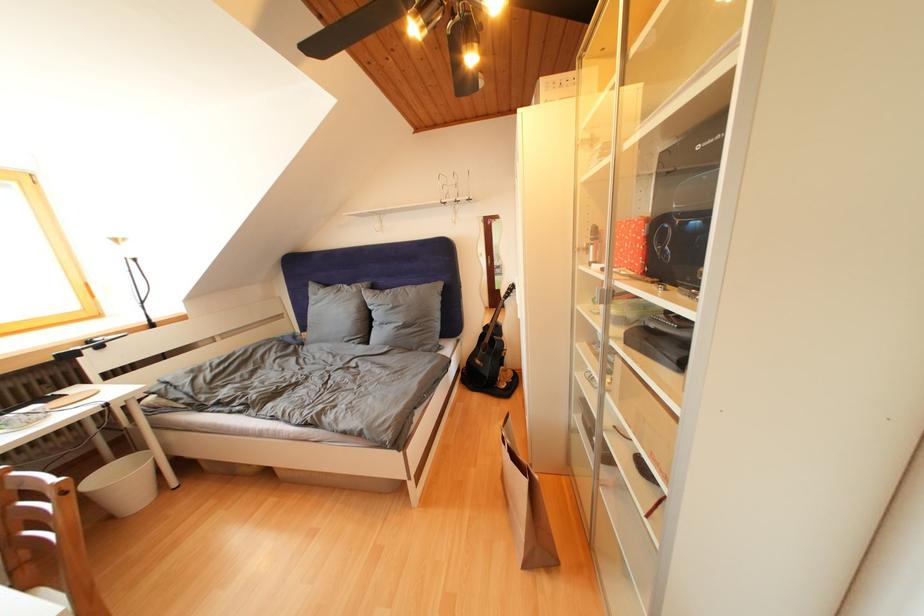
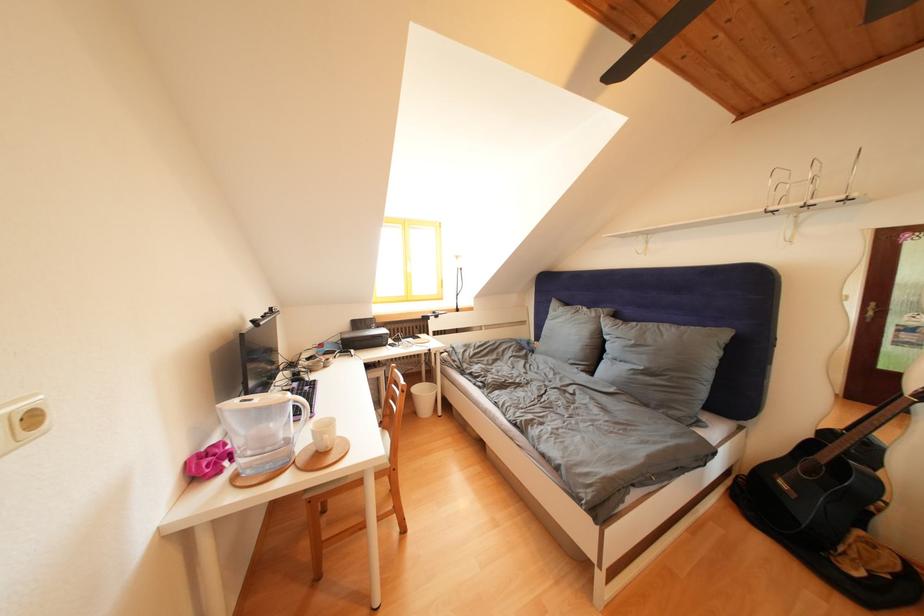
The point at [362,294] is marked in the first image. Where is the corresponding point in the second image?

(602, 320)